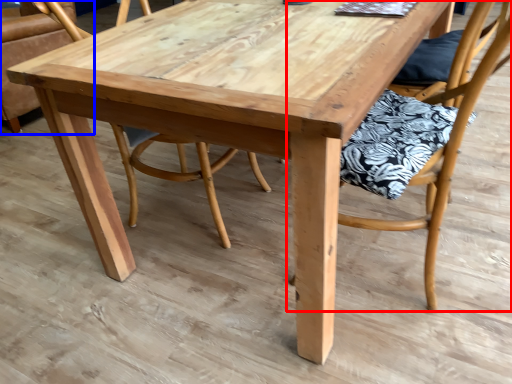
Question: Among these objects, which one is farthest to the camera, chair (highlighted by a red box) or chair (highlighted by a blue box)?

Choices:
 (A) chair
 (B) chair

Answer: (B)